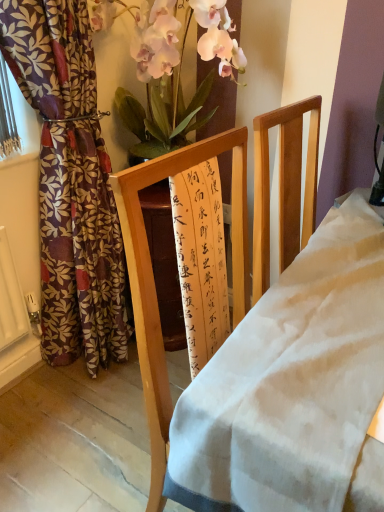
Describe the element at coordinates (294, 386) in the screenshot. This screenshot has width=384, height=512. I see `wooden frame at center` at that location.

Image resolution: width=384 pixels, height=512 pixels. What do you see at coordinates (173, 47) in the screenshot? I see `silky pink petals at upper center` at bounding box center [173, 47].

Locate an element on the screen. The width and height of the screenshot is (384, 512). silky pink petals at upper center is located at coordinates (173, 47).

Where is `floral-patterned fabric curtain at left`? The image size is (384, 512). floral-patterned fabric curtain at left is located at coordinates (70, 183).

Is silky pink petals at upper center turned away from floral-patterned fabric curtain at left?

silky pink petals at upper center is not turned away from floral-patterned fabric curtain at left.

Which is more to the right, silky pink petals at upper center or floral-patterned fabric curtain at left?

From the viewer's perspective, silky pink petals at upper center appears more on the right side.

Is silky pink petals at upper center positioned far away from floral-patterned fabric curtain at left?

No.

Are floral-patterned fabric curtain at left and wooden frame at center far apart?

Yes, floral-patterned fabric curtain at left and wooden frame at center are quite far apart.

From a real-world perspective, between floral-patterned fabric curtain at left and wooden frame at center, who is vertically higher?

floral-patterned fabric curtain at left, from a real-world perspective.

Does floral-patterned fabric curtain at left have a lesser height compared to wooden frame at center?

Incorrect, the height of floral-patterned fabric curtain at left does not fall short of that of wooden frame at center.

Considering the relative sizes of floral-patterned fabric curtain at left and silky pink petals at upper center in the image provided, is floral-patterned fabric curtain at left taller than silky pink petals at upper center?

Yes, floral-patterned fabric curtain at left is taller than silky pink petals at upper center.

Is floral-patterned fabric curtain at left facing towards silky pink petals at upper center?

No.

Is floral-patterned fabric curtain at left directly adjacent to silky pink petals at upper center?

No, floral-patterned fabric curtain at left is not touching silky pink petals at upper center.

Considering the sizes of floral-patterned fabric curtain at left and silky pink petals at upper center in the image, is floral-patterned fabric curtain at left wider or thinner than silky pink petals at upper center?

Considering their sizes, floral-patterned fabric curtain at left looks slimmer than silky pink petals at upper center.

Based on the photo, considering their positions, is wooden frame at center located in front of or behind silky pink petals at upper center?

Visually, wooden frame at center is located in front of silky pink petals at upper center.

Considering the relative sizes of wooden frame at center and silky pink petals at upper center in the image provided, is wooden frame at center smaller than silky pink petals at upper center?

No.

From the image's perspective, is wooden frame at center located above or below silky pink petals at upper center?

wooden frame at center is below silky pink petals at upper center.

From a real-world perspective, who is located higher, wooden frame at center or silky pink petals at upper center?

From a 3D spatial view, silky pink petals at upper center is above.

Which of these two, silky pink petals at upper center or wooden frame at center, is wider?

With larger width is silky pink petals at upper center.

From a real-world perspective, which object rests below the other?

wooden frame at center is physically lower.

Considering the relative positions of silky pink petals at upper center and wooden frame at center in the image provided, is silky pink petals at upper center to the right of wooden frame at center from the viewer's perspective?

No.

Which is correct: silky pink petals at upper center is inside wooden frame at center, or outside of it?

silky pink petals at upper center lies outside wooden frame at center.

Which object is positioned more to the left, wooden frame at center or floral-patterned fabric curtain at left?

floral-patterned fabric curtain at left is more to the left.

Considering the sizes of objects wooden frame at center and floral-patterned fabric curtain at left in the image provided, who is taller, wooden frame at center or floral-patterned fabric curtain at left?

floral-patterned fabric curtain at left is taller.

Looking at their sizes, would you say wooden frame at center is wider or thinner than floral-patterned fabric curtain at left?

wooden frame at center is wider than floral-patterned fabric curtain at left.

In order to click on desk below the floral-patterned fabric curtain at left (from the image's perspective) in this screenshot , I will do `click(294, 386)`.

Find the location of a particular element. This screenshot has height=512, width=384. floral arrangement above the floral-patterned fabric curtain at left (from the image's perspective) is located at coordinates (173, 47).

Locate an element on the screen. desk lying below the floral-patterned fabric curtain at left (from the image's perspective) is located at coordinates (294, 386).

Considering their positions, is floral-patterned fabric curtain at left positioned further to wooden frame at center than silky pink petals at upper center?

silky pink petals at upper center lies further to wooden frame at center than the other object.

Based on the photo, considering their positions, is wooden frame at center positioned further to floral-patterned fabric curtain at left than silky pink petals at upper center?

wooden frame at center.

From the image, which object appears to be nearer to silky pink petals at upper center, floral-patterned fabric curtain at left or wooden frame at center?

The object closer to silky pink petals at upper center is floral-patterned fabric curtain at left.

Considering their positions, is wooden frame at center positioned closer to silky pink petals at upper center than floral-patterned fabric curtain at left?

floral-patterned fabric curtain at left is positioned closer to the anchor silky pink petals at upper center.

From the image, which object appears to be farther from floral-patterned fabric curtain at left, silky pink petals at upper center or wooden frame at center?

Based on the image, wooden frame at center appears to be further to floral-patterned fabric curtain at left.

Based on their spatial positions, is silky pink petals at upper center or floral-patterned fabric curtain at left further from wooden frame at center?

silky pink petals at upper center is further to wooden frame at center.

Where is `curtain between silky pink petals at upper center and wooden frame at center vertically`? curtain between silky pink petals at upper center and wooden frame at center vertically is located at coordinates (70, 183).